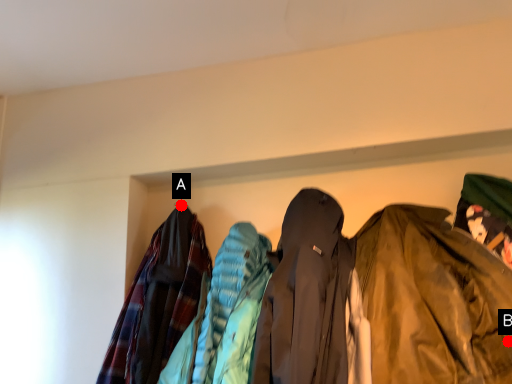
Question: Two points are circled on the image, labeled by A and B beside each circle. Which of the following is the closest to the observer?

Choices:
 (A) A is closer
 (B) B is closer

Answer: (B)